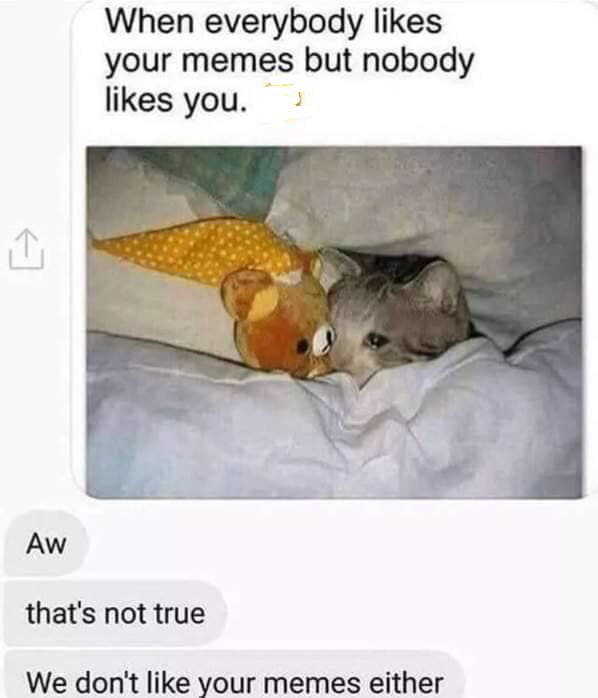
Locate an element on the screen. The image size is (598, 698). pillow is located at coordinates (479, 195).